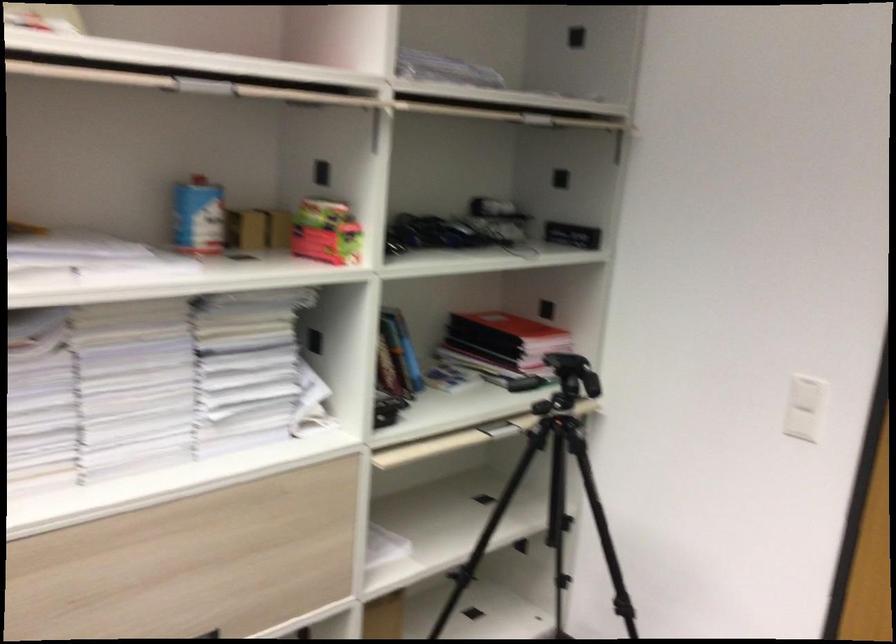
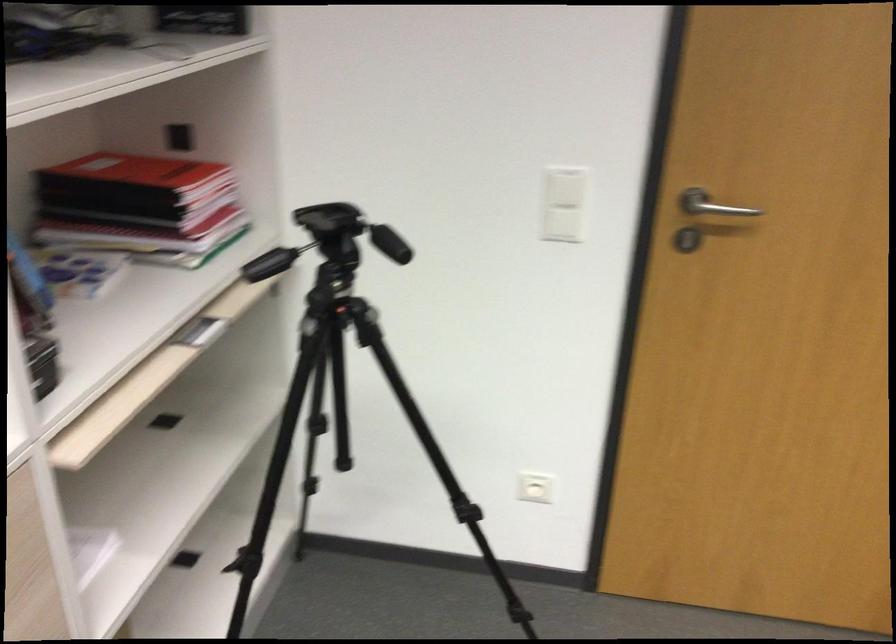
Where in the second image is the point corresponding to point 558,424 from the first image?

(334, 313)